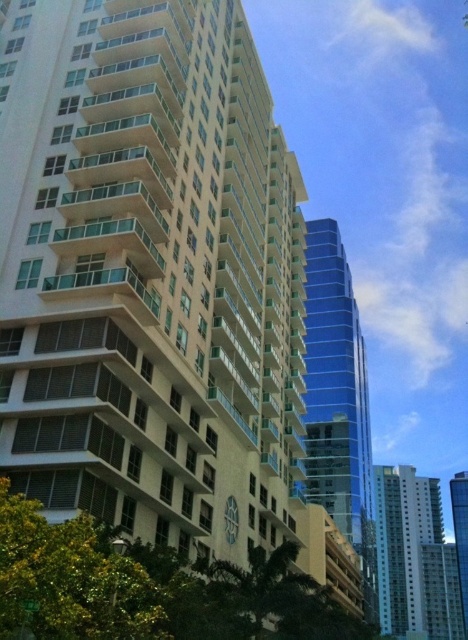
Question: Estimate the real-world distances between objects in this image. Which object is farther from the green leafy tree at lower center?

Choices:
 (A) glassy blue skyscraper at right
 (B) white glass building at lower right
 (C) shiny blue glass tower at center

Answer: (A)

Question: Is white glass building at lower right bigger than glassy blue skyscraper at right?

Choices:
 (A) yes
 (B) no

Answer: (A)

Question: Does shiny blue glass tower at center appear over green leafy tree at lower center?

Choices:
 (A) yes
 (B) no

Answer: (A)

Question: Which object appears closest to the camera in this image?

Choices:
 (A) green leafy tree at lower center
 (B) green leafy tree at lower left
 (C) white glass building at lower right

Answer: (B)

Question: Which object is the farthest from the shiny blue glass tower at center?

Choices:
 (A) glassy blue skyscraper at right
 (B) white glass building at lower right
 (C) green leafy tree at lower center
 (D) green leafy tree at lower left

Answer: (A)

Question: Where is green leafy tree at lower left located in relation to glassy blue skyscraper at right in the image?

Choices:
 (A) right
 (B) left

Answer: (B)